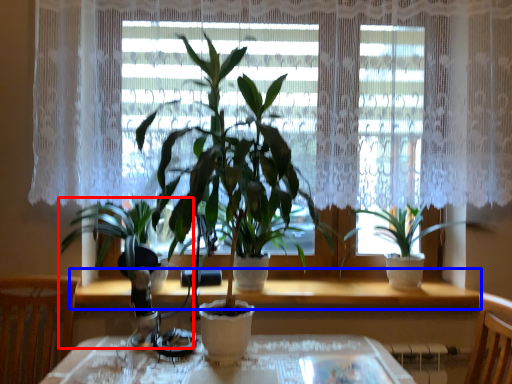
Question: Which object appears closest to the camera in this image, houseplant (highlighted by a red box) or window sill (highlighted by a blue box)?

Choices:
 (A) houseplant
 (B) window sill

Answer: (A)